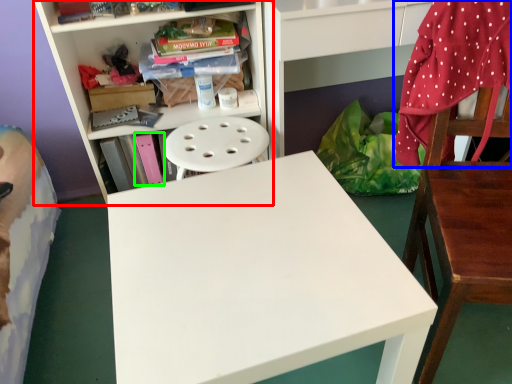
Question: Which object is the closest to the bookcase (highlighted by a red box)? Choose among these: blanket (highlighted by a blue box) or book (highlighted by a green box).

Choices:
 (A) blanket
 (B) book

Answer: (B)